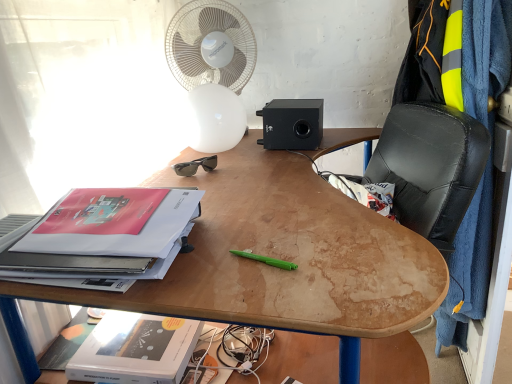
The height and width of the screenshot is (384, 512). Identify the location of free space between black plastic speaker at upper center and matte paper stack at left, which is counted as the second paperback book, starting from the bottom. (242, 177).